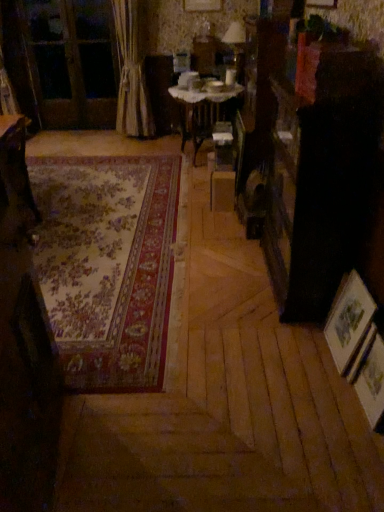
Where is `vacant position to the left of wooden picture frame at lower right, marked as the second picture frame in a back-to-front arrangement`? vacant position to the left of wooden picture frame at lower right, marked as the second picture frame in a back-to-front arrangement is located at coordinates (331, 411).